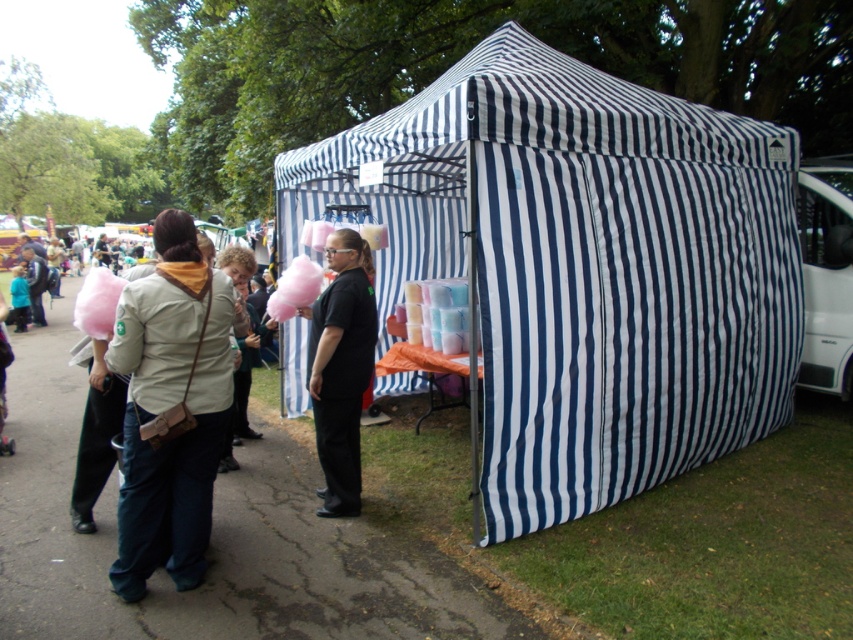
Question: Is the position of blue and white striped tent at center less distant than that of light beige fabric jacket at center?

Choices:
 (A) yes
 (B) no

Answer: (B)

Question: Which of these objects is positioned farthest from the blue and white striped tent at center?

Choices:
 (A) light beige fabric jacket at center
 (B) black matte shirt at center

Answer: (A)

Question: Which of the following is the closest to the observer?

Choices:
 (A) blue and white striped tent at center
 (B) light beige fabric jacket at center
 (C) black matte shirt at center

Answer: (B)

Question: Estimate the real-world distances between objects in this image. Which object is farther from the light beige fabric jacket at center?

Choices:
 (A) black matte shirt at center
 (B) blue and white striped tent at center

Answer: (B)

Question: Is blue and white striped tent at center to the left of light beige fabric jacket at center from the viewer's perspective?

Choices:
 (A) yes
 (B) no

Answer: (B)

Question: Is blue and white striped tent at center closer to camera compared to light beige fabric jacket at center?

Choices:
 (A) no
 (B) yes

Answer: (A)